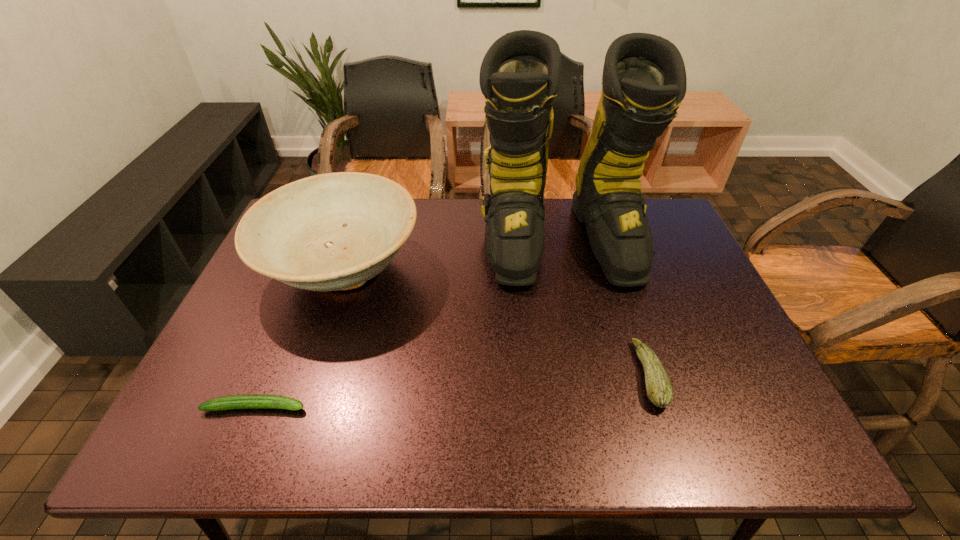
You are a GUI agent. You are given a task and a screenshot of the screen. Output one action in this format:
    pyautogui.click(x=<x>, y=<y>)
    Task: Click on the free space between the third shortest object and the tallest object
    Image resolution: width=960 pixels, height=540 pixels.
    Given the screenshot: What is the action you would take?
    pyautogui.click(x=451, y=255)

Image resolution: width=960 pixels, height=540 pixels. Identify the location of free space between the dish and the ski boots. (451, 255).

You are a GUI agent. You are given a task and a screenshot of the screen. Output one action in this format:
    pyautogui.click(x=<x>, y=<y>)
    Task: Click on the vacant point located between the third shortest object and the left zucchini
    This screenshot has width=960, height=540.
    Given the screenshot: What is the action you would take?
    point(299,339)

Where is `vacant region between the right zucchini and the tallest object`? This screenshot has height=540, width=960. vacant region between the right zucchini and the tallest object is located at coordinates (605, 307).

The height and width of the screenshot is (540, 960). What are the coordinates of `empty location between the shorter zucchini and the tallest object` in the screenshot? It's located at (408, 323).

Where is `free space between the shorter zucchini and the dish`? free space between the shorter zucchini and the dish is located at coordinates (299, 339).

Identify which object is located as the nearest to the shortest object. Please provide its 2D coordinates. Your answer should be formatted as a tuple, i.e. [(x, y)], where the tuple contains the x and y coordinates of a point satisfying the conditions above.

[(328, 232)]

Locate an element on the screen. The height and width of the screenshot is (540, 960). object that is the closest to the shortest object is located at coordinates (328, 232).

The width and height of the screenshot is (960, 540). I want to click on free spot that satisfies the following two spatial constraints: 1. on the back side of the tallest object; 2. on the right side of the third shortest object, so click(353, 240).

You are a GUI agent. You are given a task and a screenshot of the screen. Output one action in this format:
    pyautogui.click(x=<x>, y=<y>)
    Task: Click on the vacant space that satisfies the following two spatial constraints: 1. on the back side of the dish; 2. on the right side of the tallest object
    
    Given the screenshot: What is the action you would take?
    pyautogui.click(x=353, y=240)